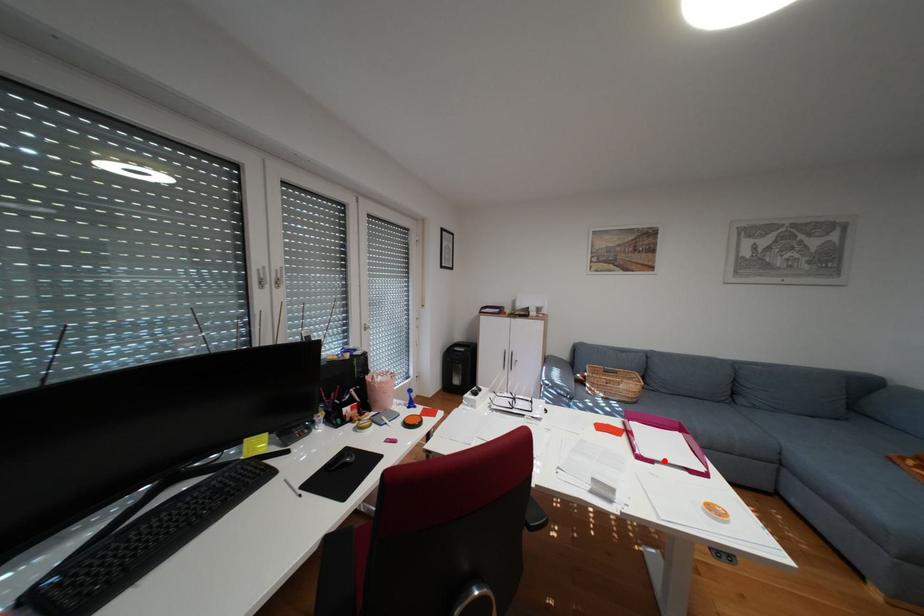
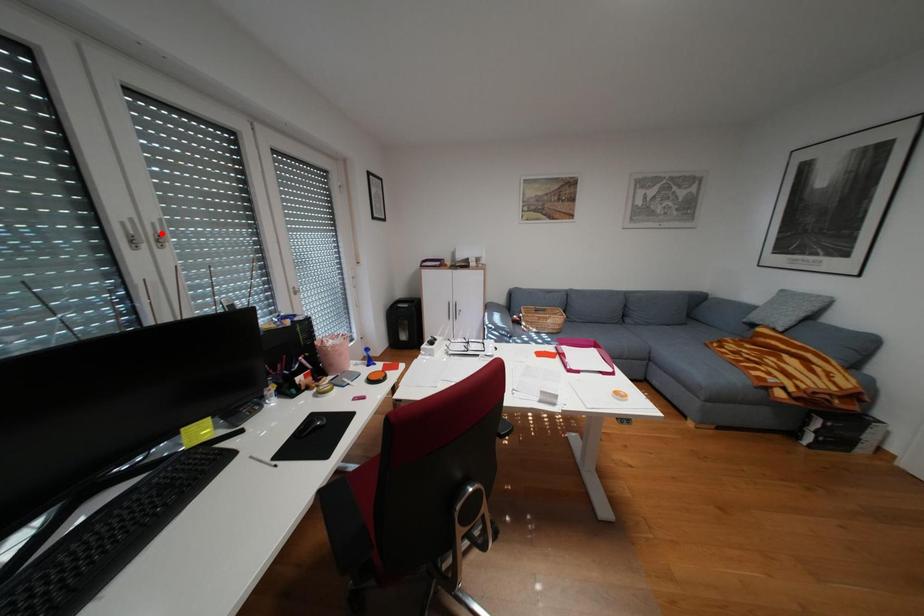
I am providing you with two images of the same scene from different viewpoints. A red point is marked on the first image and another point is marked on the second image. Is the marked point in image1 the same physical position as the marked point in image2?

No